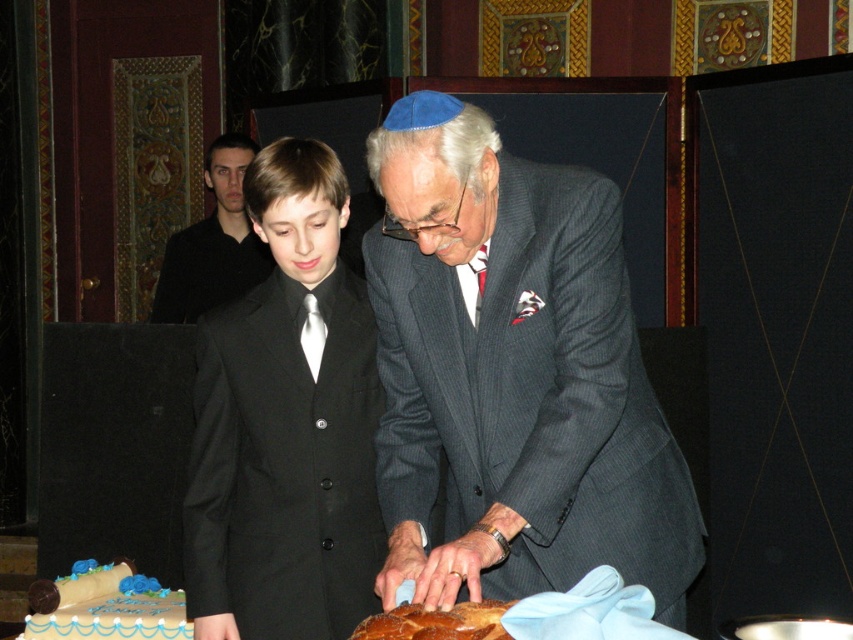
You are standing in front of the cake and want to place a decoration on the point that is closer to you. Which point should you choose between point (221, 326) and point (194, 260)?

You should choose point (221, 326) because it is closer to the viewer than point (194, 260).

From the picture: What are the coordinates of the black satin suit at center?

The coordinates of the black satin suit at center are at point [286,424].

You are a photographer at the event and need to frame a shot that includes both the matte gray suit at center and the blue frosted cake at lower left. Given their sizes, which object should you ensure is closer to the camera to maintain both in focus without adjusting the aperture?

The matte gray suit at center is larger in size than the blue frosted cake at lower left, so you should position the matte gray suit at center closer to the camera to ensure both are in focus without changing the aperture.